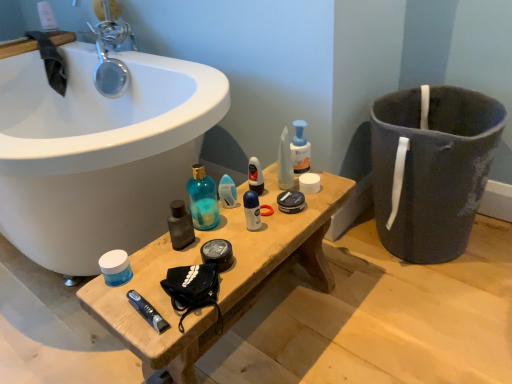
Find the location of a particular element. The image size is (512, 384). free space on the front side of translucent plastic soap dispenser at center, positioned as the 1th toiletry in right-to-left order is located at coordinates (284, 214).